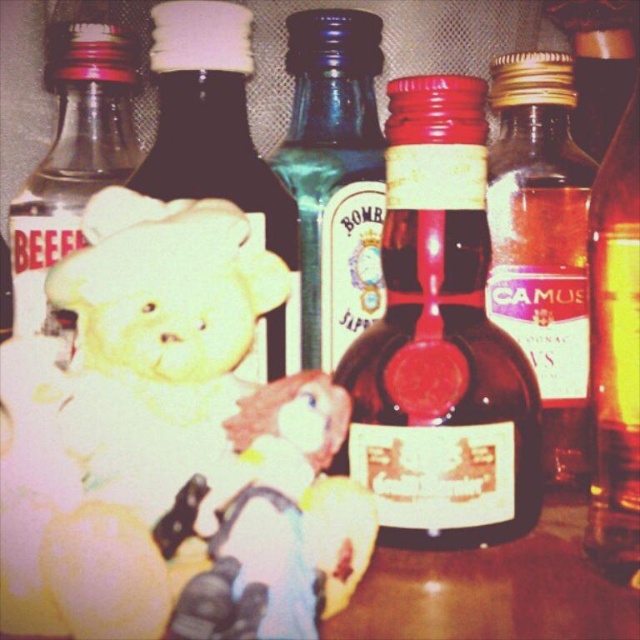
Is amber glass bottle at center to the right of clear glass bottle at left from the viewer's perspective?

Indeed, amber glass bottle at center is positioned on the right side of clear glass bottle at left.

Measure the distance between point (500, 266) and camera.

→ Point (500, 266) and camera are 14.62 inches apart.

Between point (499, 280) and point (74, 170), which one is positioned in front?

Point (499, 280) is in front.

This screenshot has width=640, height=640. What are the coordinates of `amber glass bottle at center` in the screenshot? It's located at (541, 243).

Is yellow plush toy at center positioned before translucent glass bottle at center?

Yes.

Who is more forward, (364, 513) or (330, 272)?

Point (364, 513) is in front.

Measure the distance between point (x=300, y=490) and camera.

Point (x=300, y=490) is 8.81 inches away from camera.

This screenshot has width=640, height=640. What are the coordinates of `yellow plush toy at center` in the screenshot? It's located at (278, 522).

Which of these two, yellow plush toy at center or translucent amber glass bottle at right, stands shorter?

With less height is yellow plush toy at center.

Which is above, yellow plush toy at center or translucent amber glass bottle at right?

translucent amber glass bottle at right is higher up.

Who is more forward, (x=243, y=568) or (x=602, y=236)?

Point (x=243, y=568)

The image size is (640, 640). In order to click on yellow plush toy at center in this screenshot , I will do `click(278, 522)`.